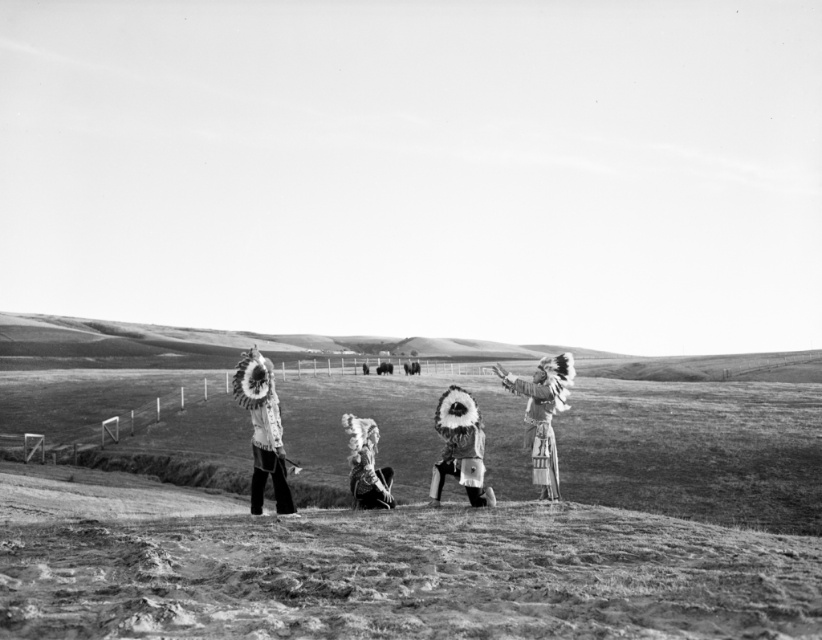
Can you confirm if feathered headdress at right is bigger than feathered headdress at center?

Correct, feathered headdress at right is larger in size than feathered headdress at center.

At what (x,y) coordinates should I click in order to perform the action: click on feathered headdress at right. Please return your answer as a coordinate pair (x, y). The width and height of the screenshot is (822, 640). Looking at the image, I should click on (543, 413).

Locate an element on the screen. This screenshot has height=640, width=822. feathered headdress at right is located at coordinates (543, 413).

What do you see at coordinates (262, 429) in the screenshot? This screenshot has height=640, width=822. I see `white feather headdress at center` at bounding box center [262, 429].

Locate an element on the screen. white feather headdress at center is located at coordinates (262, 429).

Does grassy hillside at center have a lesser height compared to feathered headdress at center?

In fact, grassy hillside at center may be taller than feathered headdress at center.

Does grassy hillside at center lie in front of feathered headdress at center?

No, it is not.

Between point (12, 330) and point (375, 483), which one is positioned in front?

Positioned in front is point (375, 483).

Find the location of a particular element. This screenshot has height=640, width=822. grassy hillside at center is located at coordinates (210, 346).